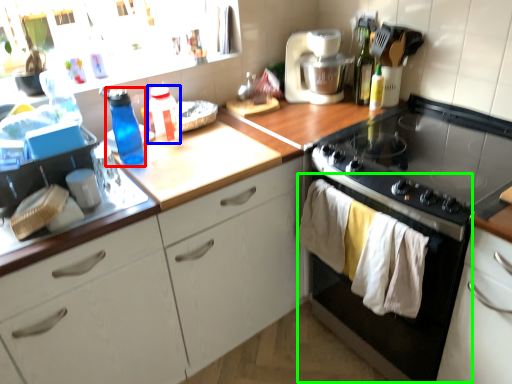
Question: Which is farther away from bottle (highlighted by a red box)? bottle (highlighted by a blue box) or oven (highlighted by a green box)?

Choices:
 (A) bottle
 (B) oven

Answer: (B)